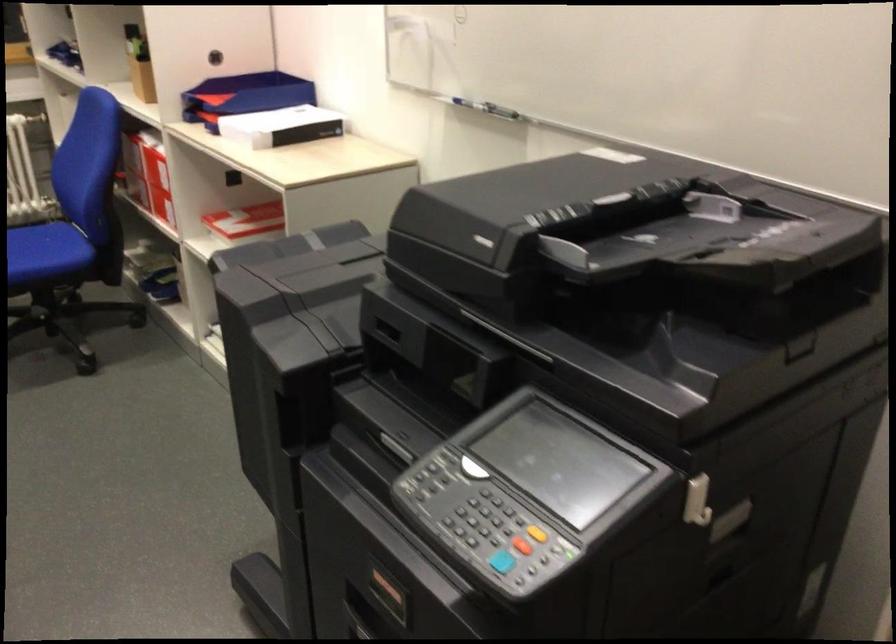
This screenshot has height=644, width=896. Describe the element at coordinates (478, 105) in the screenshot. I see `the whiteboard marker` at that location.